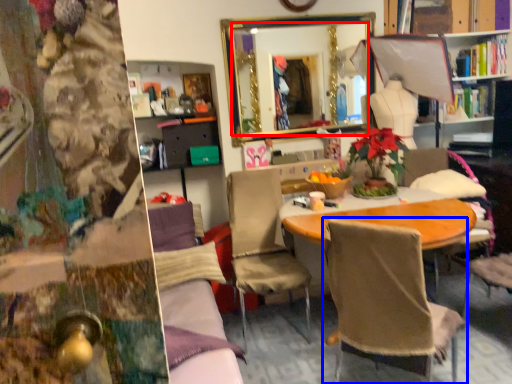
Question: Which object is further to the camera taking this photo, mirror (highlighted by a red box) or chair (highlighted by a blue box)?

Choices:
 (A) mirror
 (B) chair

Answer: (A)